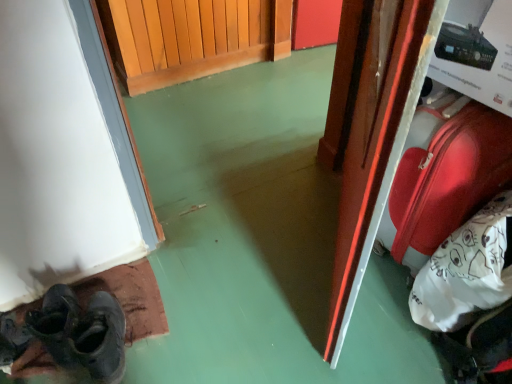
Find the location of a particular element. free spot to the right of dark gray leather shoe at lower left is located at coordinates (179, 338).